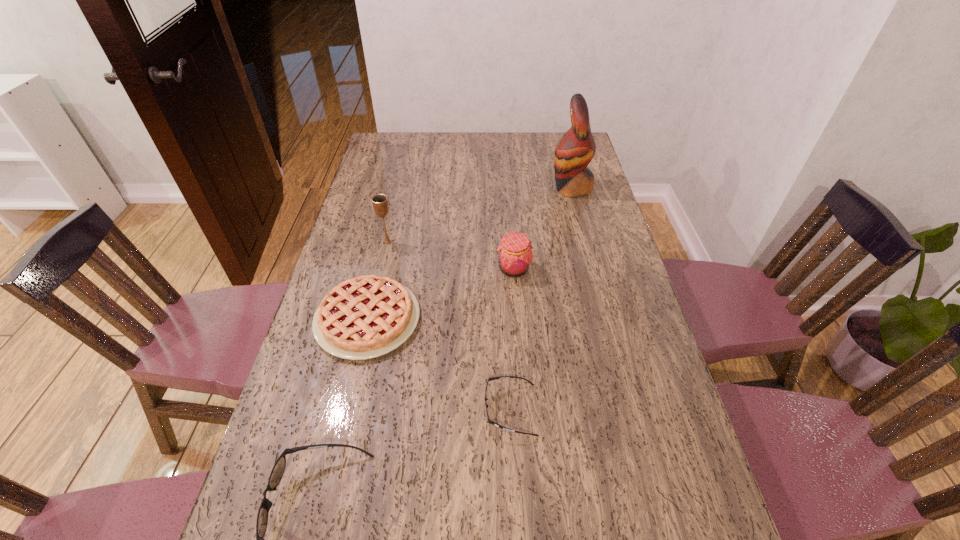
All sunglassess are currently evenly spaced. To continue this pattern, where would you add another sunglasses on the right? Please point out a vacant spot. Please provide its 2D coordinates. Your answer should be formatted as a tuple, i.e. [(x, y)], where the tuple contains the x and y coordinates of a point satisfying the conditions above.

[(653, 338)]